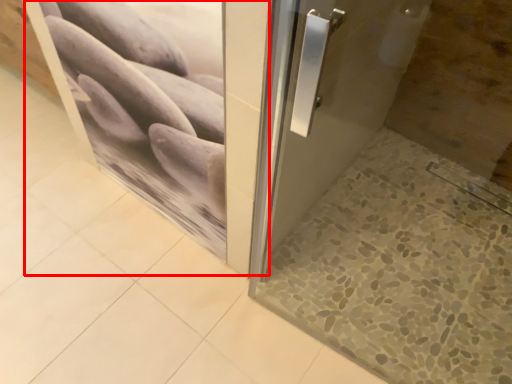
Question: Considering the relative positions of screen door (annotated by the red box) and tile in the image provided, where is screen door (annotated by the red box) located with respect to the staircase?

Choices:
 (A) left
 (B) right

Answer: (A)